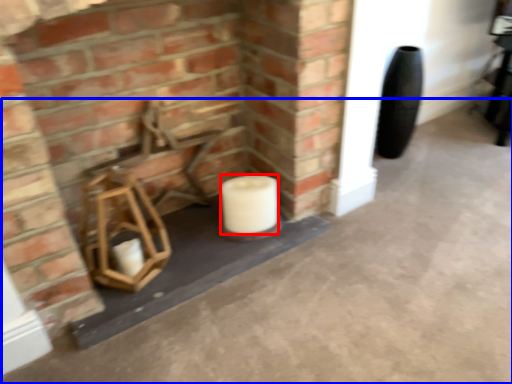
Question: Which object appears farthest to the camera in this image, toilet paper (highlighted by a red box) or concrete (highlighted by a blue box)?

Choices:
 (A) toilet paper
 (B) concrete

Answer: (A)